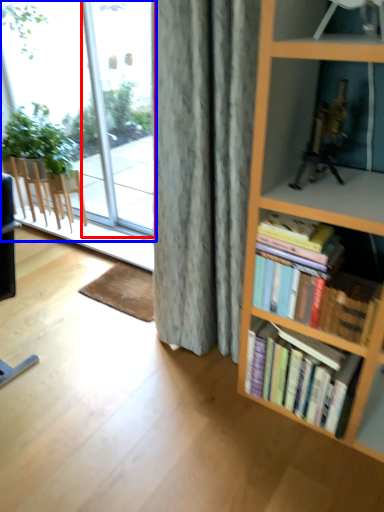
Question: Which object is further to the camera taking this photo, glass door (highlighted by a red box) or window (highlighted by a blue box)?

Choices:
 (A) glass door
 (B) window

Answer: (B)